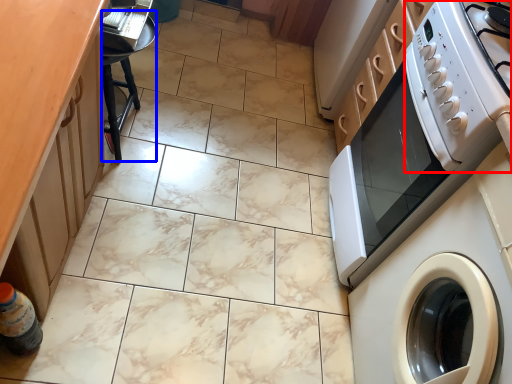
Question: Which object is closer to the camera taking this photo, appliance (highlighted by a red box) or bar stool (highlighted by a blue box)?

Choices:
 (A) appliance
 (B) bar stool

Answer: (A)